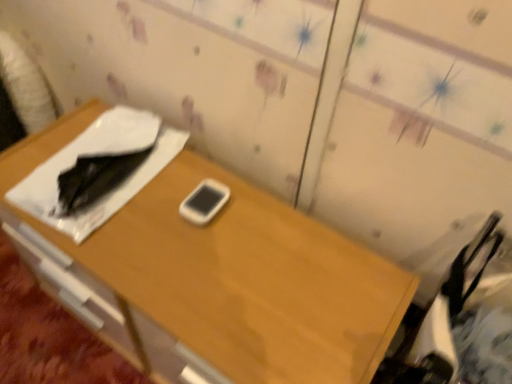
At what (x,y) coordinates should I click in order to perform the action: click on vacant point above wooden desk at center (from a real-world perspective). Please return your answer as a coordinate pair (x, y). Looking at the image, I should click on (179, 233).